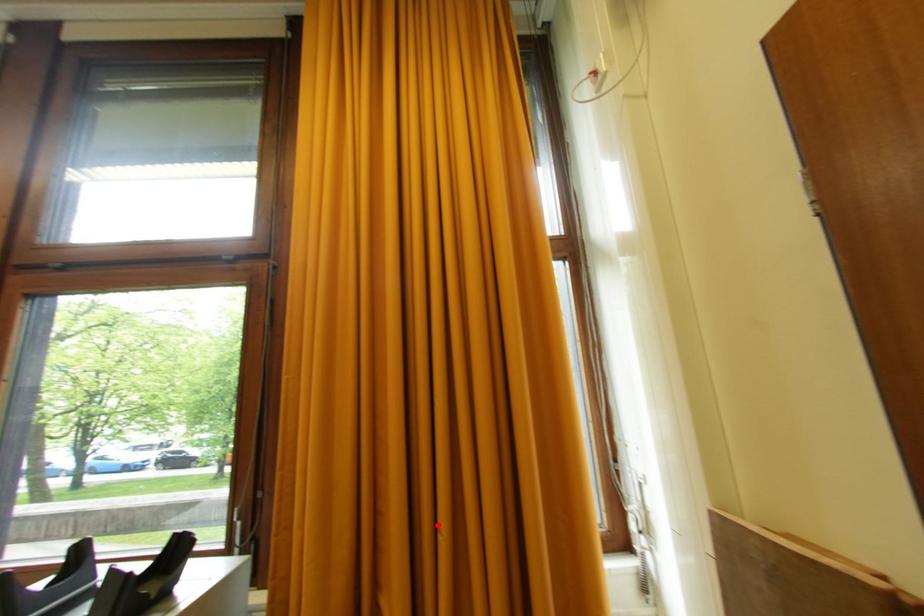
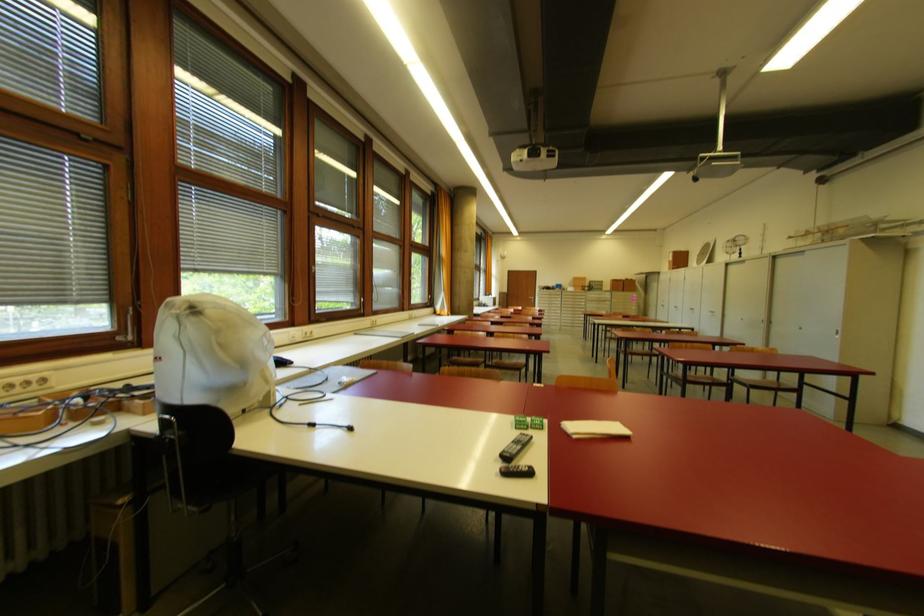
Question: I am providing you with two images of the same scene from different viewpoints. A red point is marked on the first image. At the location where the point appears in image 1, is it still visible in image 2?

Choices:
 (A) Yes
 (B) No

Answer: (B)